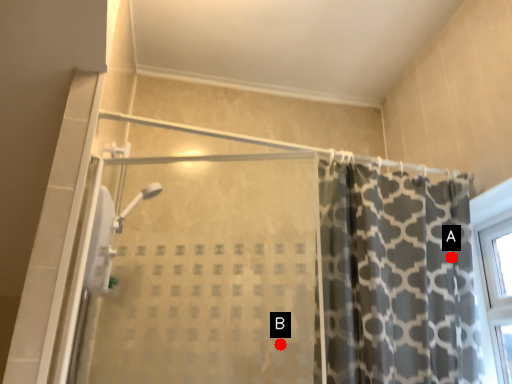
Question: Two points are circled on the image, labeled by A and B beside each circle. Which point is closer to the camera?

Choices:
 (A) A is closer
 (B) B is closer

Answer: (B)